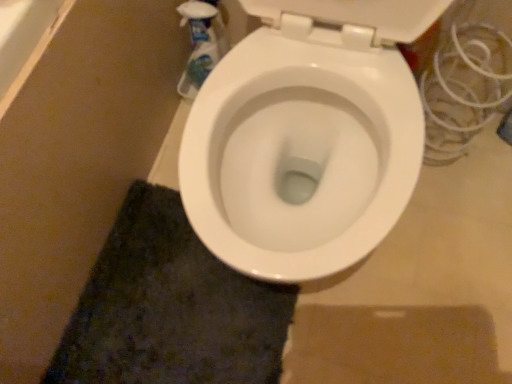
Question: Is point (106, 307) positioned closer to the camera than point (188, 72)?

Choices:
 (A) closer
 (B) farther

Answer: (A)

Question: Is dark green shaggy carpet at lower left in front of or behind translucent plastic spray bottle at upper left in the image?

Choices:
 (A) behind
 (B) front

Answer: (B)

Question: Choose the correct answer: Is dark green shaggy carpet at lower left inside translucent plastic spray bottle at upper left or outside it?

Choices:
 (A) outside
 (B) inside

Answer: (A)

Question: Is translucent plastic spray bottle at upper left taller or shorter than dark green shaggy carpet at lower left?

Choices:
 (A) tall
 (B) short

Answer: (A)

Question: In terms of width, does translucent plastic spray bottle at upper left look wider or thinner when compared to dark green shaggy carpet at lower left?

Choices:
 (A) thin
 (B) wide

Answer: (A)

Question: From a real-world perspective, is translucent plastic spray bottle at upper left positioned above or below dark green shaggy carpet at lower left?

Choices:
 (A) below
 (B) above

Answer: (B)

Question: Is translucent plastic spray bottle at upper left inside the boundaries of dark green shaggy carpet at lower left, or outside?

Choices:
 (A) outside
 (B) inside

Answer: (A)